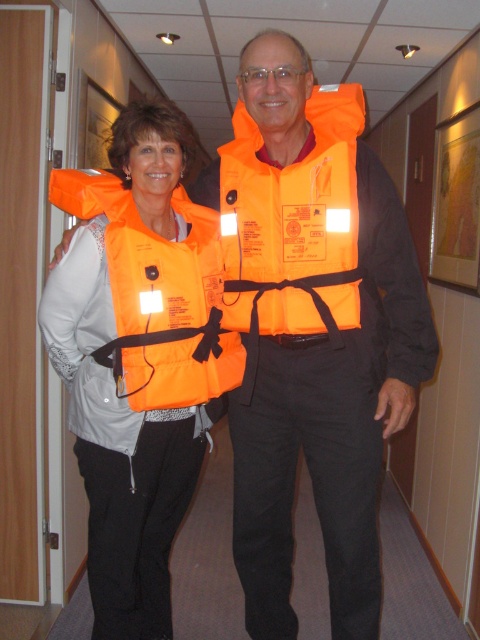
Both individuals are wearing orange fabric life jackets. Which one is taller, the orange fabric life jacket at center or the orange fabric life jacket at left?

The orange fabric life jacket at center is much taller than the orange fabric life jacket at left.